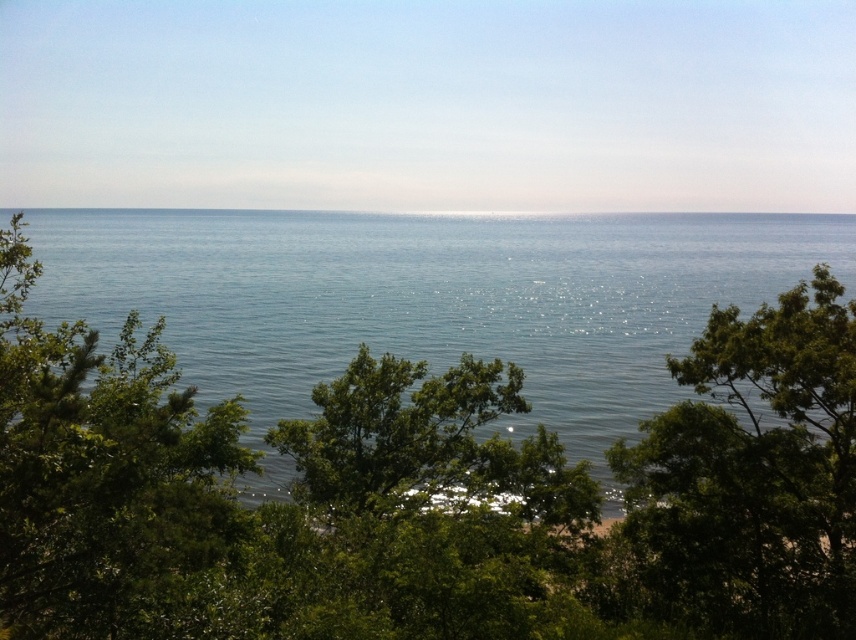
You are standing at the center of the image and want to locate the clear blue water at center. According to the coordinates provided, in which direction should you look to find it?

The clear blue water at center is located at coordinates point (429, 298), so you should look directly ahead since it is positioned at the center of the image.

You are standing at the edge of the scene and want to reach the green leafy tree at center. Which direction should you move to get closer to it without going into the clear blue water at center?

The clear blue water at center is closer to the viewer than the green leafy tree at center. To reach the green leafy tree at center without entering the water, you should move backward away from the clear blue water at center.

You are standing at the edge of the coastal scene and want to take a photo that captures both the clear blue water at center and the green leafy tree at center. Which object will occupy more space in your photo?

The clear blue water at center will occupy more space in your photo because it has a larger size compared to the green leafy tree at center.